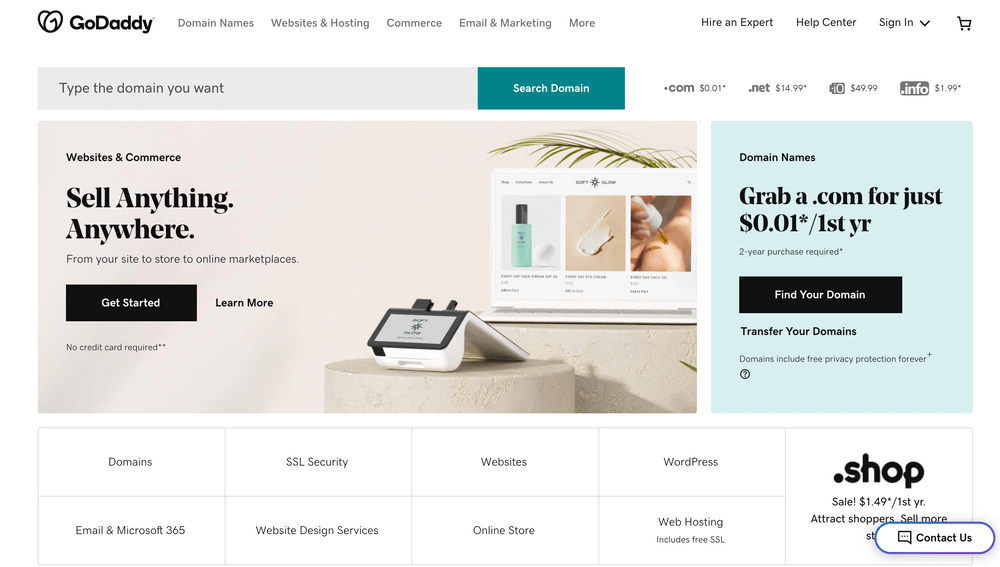
At what (x,y) coordinates should I click in order to perform the action: click on wall. Please return your answer as a coordinate pair (x, y). Image resolution: width=1000 pixels, height=567 pixels. Looking at the image, I should click on tap(365, 186).